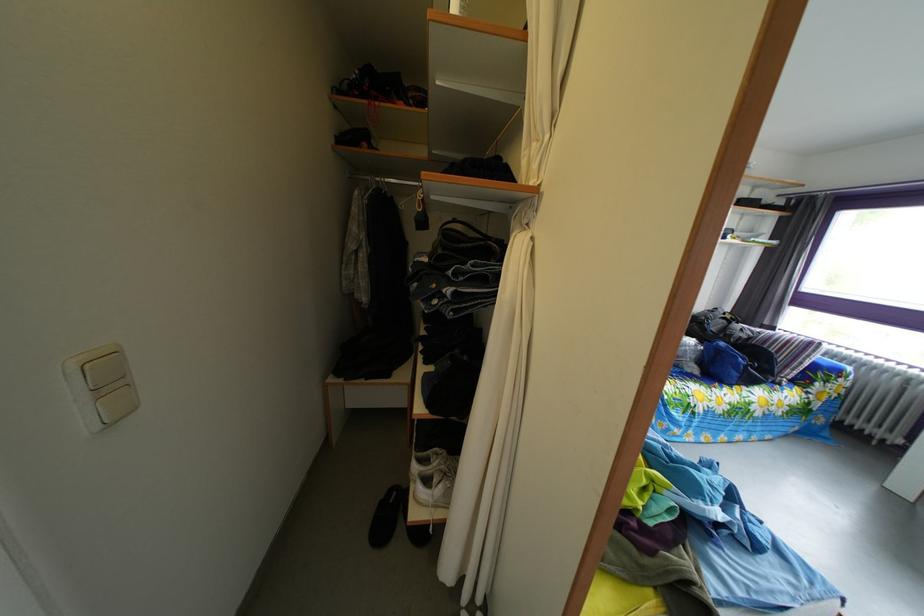
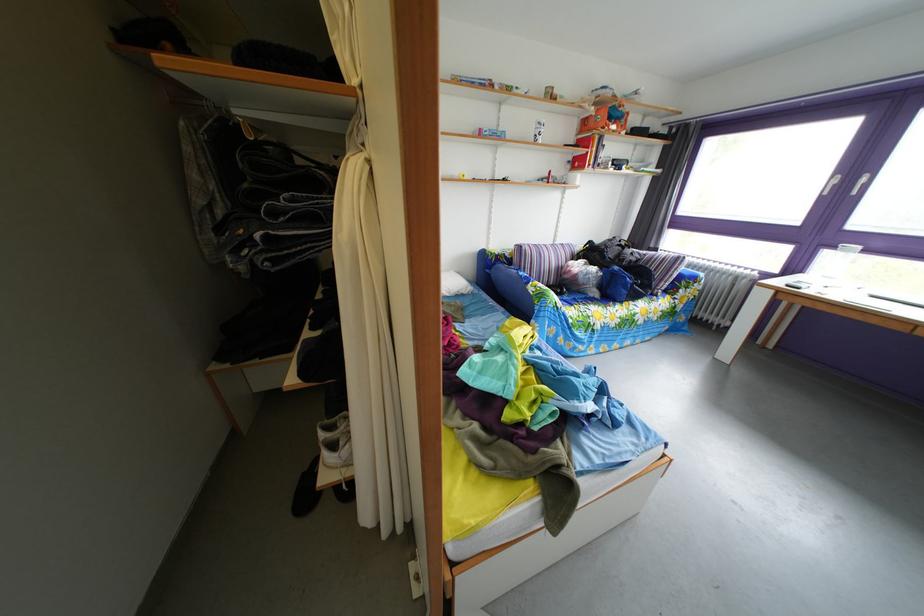
Question: What movement of the cameraman would produce the second image?

Choices:
 (A) Left
 (B) Right
 (C) Forward
 (D) Backward

Answer: (B)